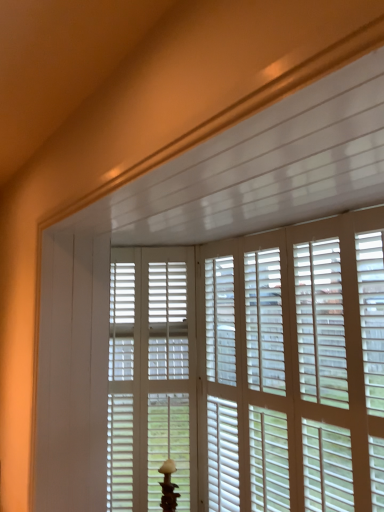
Question: From a real-world perspective, is white matte table lamp at center on white matte window blind at center?

Choices:
 (A) yes
 (B) no

Answer: (B)

Question: Is there a large distance between white matte table lamp at center and white matte window blind at center?

Choices:
 (A) yes
 (B) no

Answer: (B)

Question: Is white matte table lamp at center outside of white matte window blind at center?

Choices:
 (A) no
 (B) yes

Answer: (B)

Question: Considering the relative sizes of white matte table lamp at center and white matte window blind at center in the image provided, is white matte table lamp at center bigger than white matte window blind at center?

Choices:
 (A) yes
 (B) no

Answer: (B)

Question: Is the surface of white matte table lamp at center in direct contact with white matte window blind at center?

Choices:
 (A) yes
 (B) no

Answer: (B)

Question: Is white matte table lamp at center aimed at white matte window blind at center?

Choices:
 (A) no
 (B) yes

Answer: (A)

Question: Considering the relative sizes of white matte screen door at center and white matte table lamp at center in the image provided, is white matte screen door at center smaller than white matte table lamp at center?

Choices:
 (A) yes
 (B) no

Answer: (B)

Question: From a real-world perspective, is white matte screen door at center physically above white matte table lamp at center?

Choices:
 (A) yes
 (B) no

Answer: (A)

Question: Are white matte screen door at center and white matte table lamp at center beside each other?

Choices:
 (A) yes
 (B) no

Answer: (B)

Question: Considering the relative sizes of white matte screen door at center and white matte table lamp at center in the image provided, is white matte screen door at center wider than white matte table lamp at center?

Choices:
 (A) yes
 (B) no

Answer: (B)

Question: Is white matte screen door at center not inside white matte table lamp at center?

Choices:
 (A) no
 (B) yes

Answer: (B)

Question: Is white matte screen door at center in front of white matte table lamp at center?

Choices:
 (A) no
 (B) yes

Answer: (A)

Question: Is white matte screen door at center far from white matte window blind at center?

Choices:
 (A) no
 (B) yes

Answer: (A)